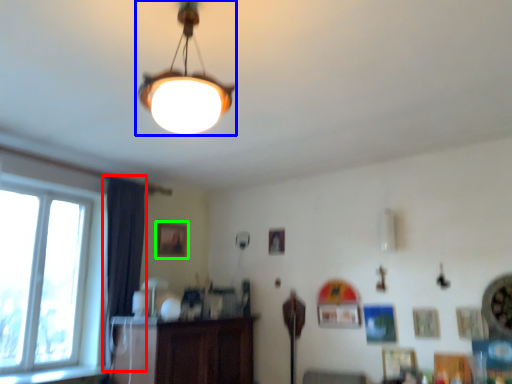
Question: Considering the real-world distances, which object is closest to curtain (highlighted by a red box)? lamp (highlighted by a blue box) or picture frame (highlighted by a green box).

Choices:
 (A) lamp
 (B) picture frame

Answer: (B)